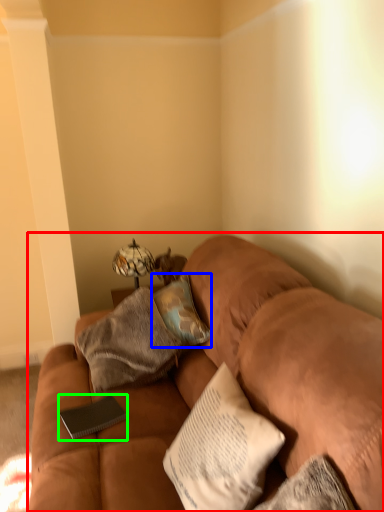
Question: Which is farther away from studio couch (highlighted by a red box)? pillow (highlighted by a blue box) or pad (highlighted by a green box)?

Choices:
 (A) pillow
 (B) pad

Answer: (B)